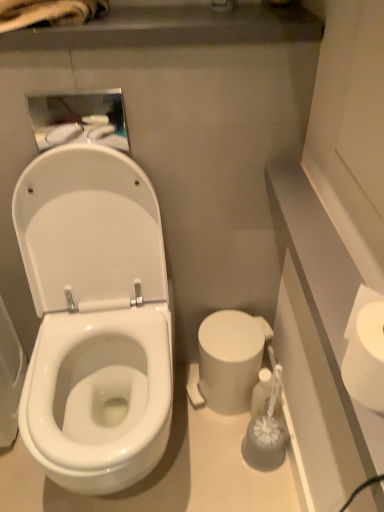
Question: Based on their sizes in the image, would you say white glossy toilet at left is bigger or smaller than white glossy medicine cabinet at upper left?

Choices:
 (A) big
 (B) small

Answer: (A)

Question: Does point click(104, 202) appear closer or farther from the camera than point click(52, 96)?

Choices:
 (A) farther
 (B) closer

Answer: (A)

Question: Estimate the real-world distances between objects in this image. Which object is closer to the white matte toilet paper at right?

Choices:
 (A) white glossy medicine cabinet at upper left
 (B) translucent plastic brush at lower right
 (C) white glossy toilet at left

Answer: (B)

Question: Based on their relative distances, which object is farther from the white glossy medicine cabinet at upper left?

Choices:
 (A) translucent plastic brush at lower right
 (B) white glossy toilet at left
 (C) white matte toilet paper at right

Answer: (A)